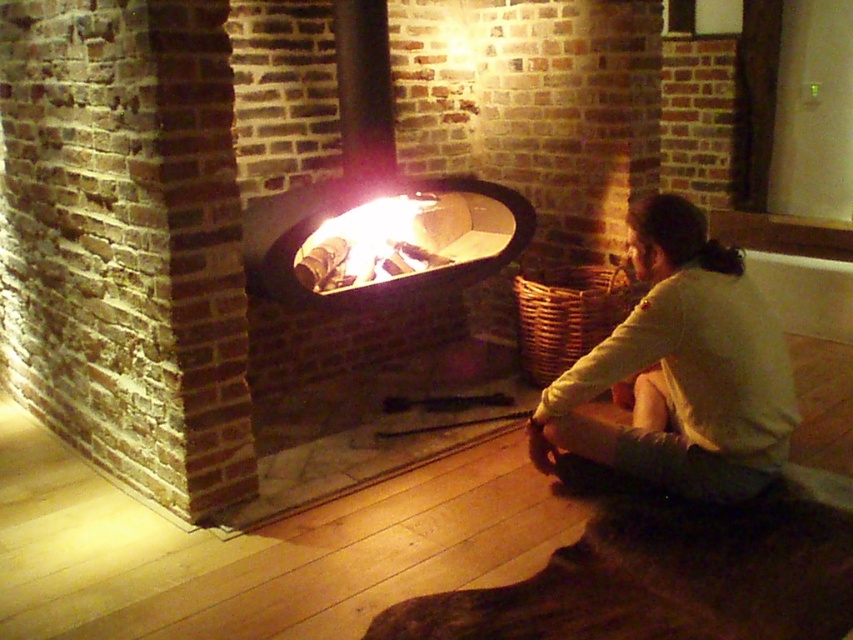
Question: Does light beige cotton shirt at lower right have a larger size compared to smooth black fire pit at center?

Choices:
 (A) yes
 (B) no

Answer: (B)

Question: Is light beige cotton shirt at lower right above charcoal wood fire at center?

Choices:
 (A) no
 (B) yes

Answer: (A)

Question: Which point appears closest to the camera in this image?

Choices:
 (A) (701, 356)
 (B) (376, 211)
 (C) (370, 237)

Answer: (A)

Question: Considering the real-world distances, which object is closest to the light beige cotton shirt at lower right?

Choices:
 (A) charcoal wood fire at center
 (B) smooth black fire pit at center

Answer: (B)

Question: Which of the following is the farthest from the observer?

Choices:
 (A) (734, 392)
 (B) (329, 260)

Answer: (B)

Question: Is light beige cotton shirt at lower right wider than charcoal wood fire at center?

Choices:
 (A) no
 (B) yes

Answer: (B)